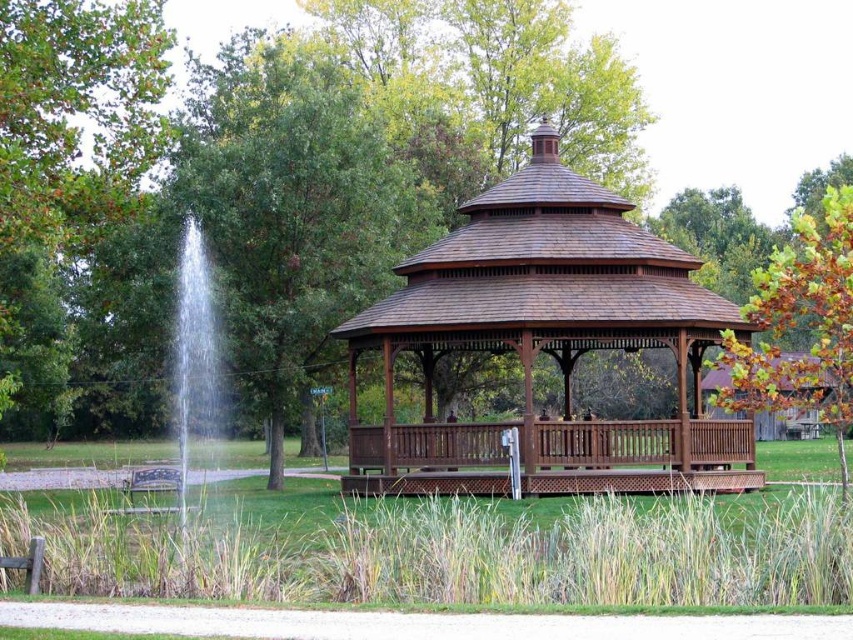
You are planning to host a small gathering in the park and need to decide where to place a large picnic blanket. Given the space available near the brown wooden gazebo at center and the wooden bench at lower left, which location would allow more people to comfortably gather without overcrowding?

The brown wooden gazebo at center is bigger than the wooden bench at lower left, so placing the picnic blanket near the brown wooden gazebo at center would accommodate more people comfortably.

You are a visitor standing in the park and want to take a photo of both the brown wooden gazebo at center and the green leafy tree at center. Which object should you position closer to the camera to include both in your shot?

The brown wooden gazebo at center is below the green leafy tree at center, so you should position the green leafy tree at center closer to the camera to include both in your shot.